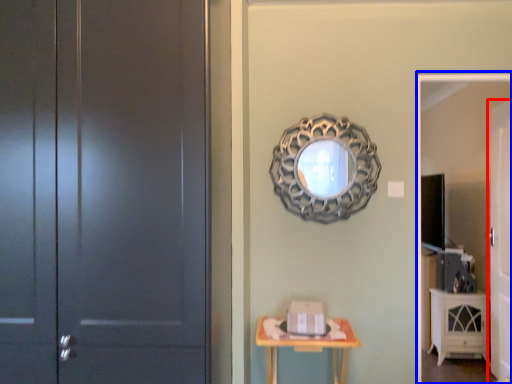
Question: Which point is closer to the camera, door (highlighted by a red box) or screen door (highlighted by a blue box)?

Choices:
 (A) door
 (B) screen door

Answer: (B)